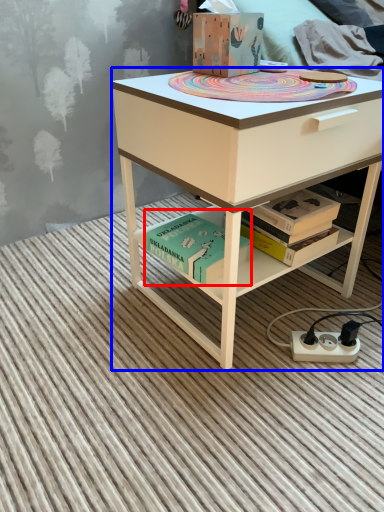
Question: Which object appears farthest to the camera in this image, book (highlighted by a red box) or desk (highlighted by a blue box)?

Choices:
 (A) book
 (B) desk

Answer: (A)